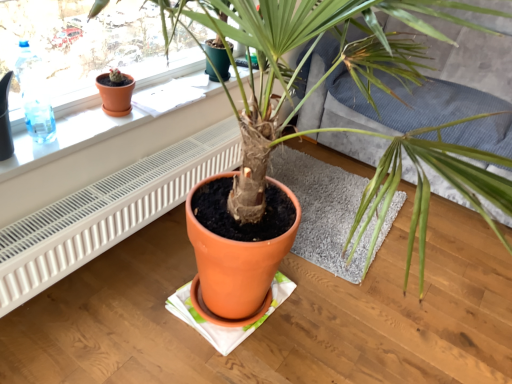
This screenshot has height=384, width=512. I want to click on vacant space behind transparent plastic bottle at upper left, so pos(78,118).